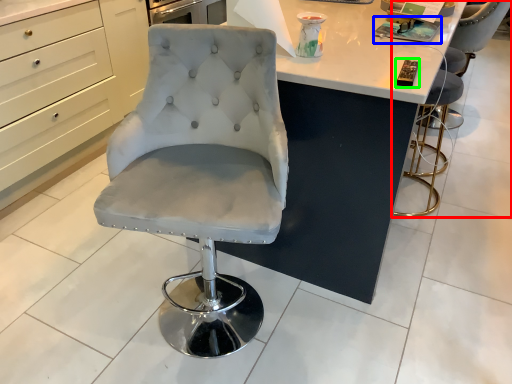
Question: Considering the real-world distances, which object is closest to chair (highlighted by a red box)? magazine (highlighted by a blue box) or magazine (highlighted by a green box).

Choices:
 (A) magazine
 (B) magazine

Answer: (A)